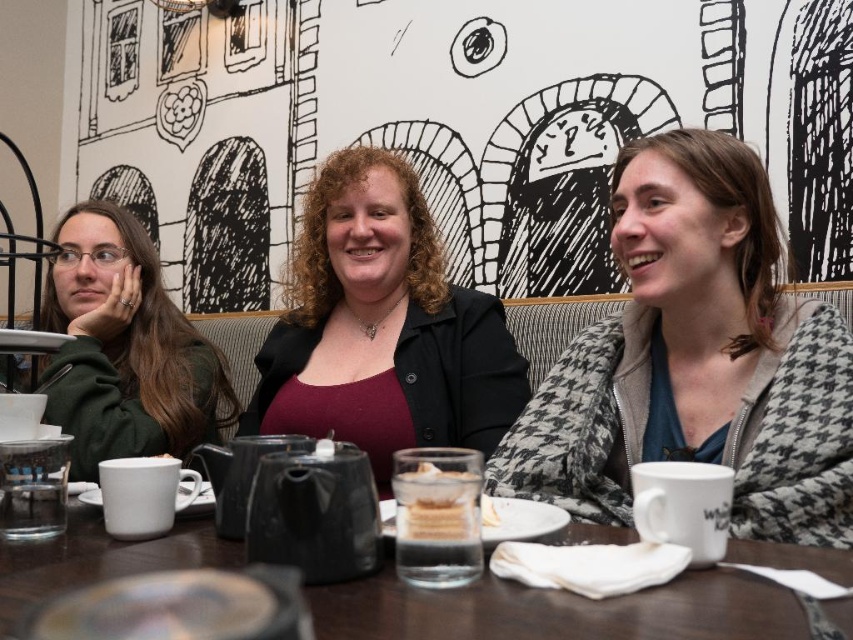
In the scene shown: Can you confirm if white ceramic mug at upper right is positioned below matte white mug at center?

Actually, white ceramic mug at upper right is above matte white mug at center.

Can you confirm if white ceramic mug at upper right is taller than matte white mug at center?

Correct, white ceramic mug at upper right is much taller as matte white mug at center.

Image resolution: width=853 pixels, height=640 pixels. I want to click on white ceramic mug at upper right, so click(x=695, y=358).

The image size is (853, 640). Identify the location of white ceramic mug at upper right. (695, 358).

Between white ceramic mug at upper right and white ceramic mug at lower right, which one has less height?

white ceramic mug at lower right

Which is in front, point (828, 340) or point (718, 540)?

Point (718, 540) is more forward.

Between point (641, 157) and point (718, 513), which one is positioned behind?

The point (641, 157) is more distant.

Locate an element on the screen. white ceramic mug at upper right is located at coordinates (695, 358).

Looking at this image, who is positioned more to the right, green matte jacket at left or white ceramic mug at lower right?

Positioned to the right is white ceramic mug at lower right.

Can you confirm if green matte jacket at left is thinner than white ceramic mug at lower right?

In fact, green matte jacket at left might be wider than white ceramic mug at lower right.

Which is behind, point (99, 278) or point (641, 476)?

Point (99, 278)

Find the location of `green matte jacket at left`. green matte jacket at left is located at coordinates 125,348.